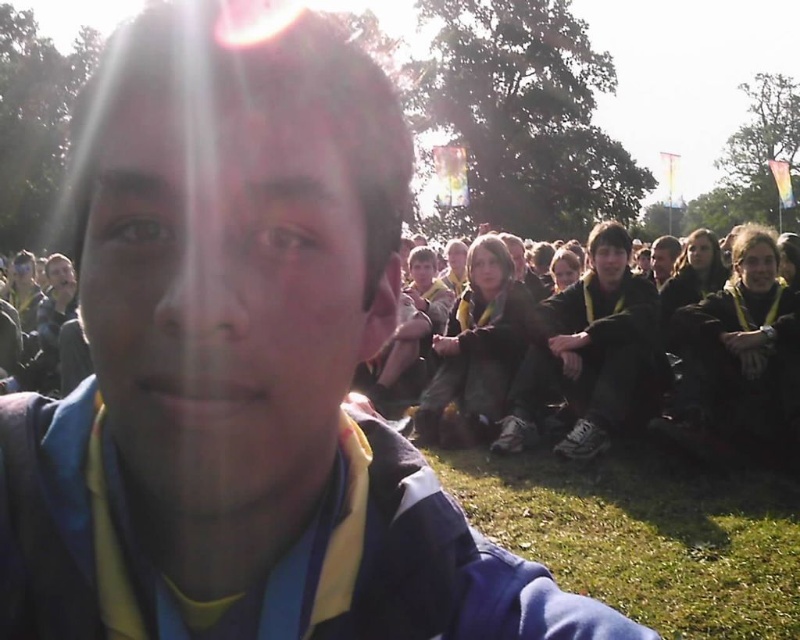
Based on the photo, between green grass at lower right and dark brown leather jacket at center, which one is positioned lower?

green grass at lower right

Is green grass at lower right positioned at the back of dark brown leather jacket at center?

No, it is in front of dark brown leather jacket at center.

Locate an element on the screen. Image resolution: width=800 pixels, height=640 pixels. green grass at lower right is located at coordinates (645, 534).